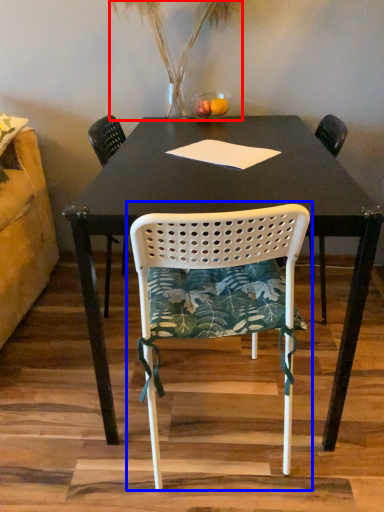
Question: Which object appears farthest to the camera in this image, plant (highlighted by a red box) or chair (highlighted by a blue box)?

Choices:
 (A) plant
 (B) chair

Answer: (A)